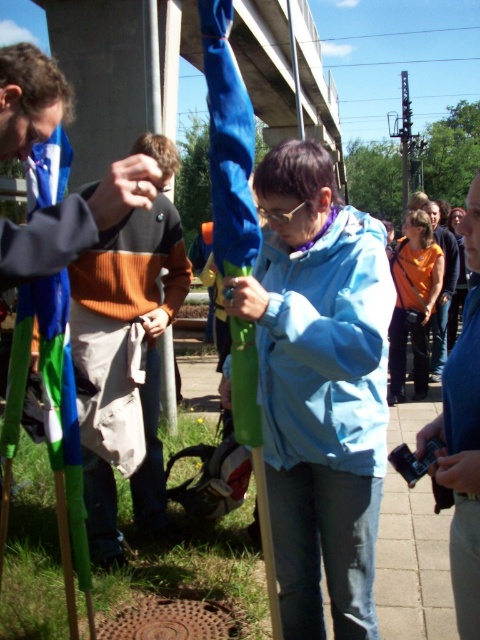
Question: Where is matte black jacket at left located in relation to orange fabric at right in the image?

Choices:
 (A) below
 (B) above

Answer: (B)

Question: Based on their relative distances, which object is farther from the light blue fabric jacket at center?

Choices:
 (A) orange fabric at right
 (B) matte black jacket at left

Answer: (B)

Question: Is light blue fabric jacket at center smaller than matte black jacket at left?

Choices:
 (A) yes
 (B) no

Answer: (A)

Question: Can you confirm if light blue fabric jacket at center is smaller than orange fabric at right?

Choices:
 (A) no
 (B) yes

Answer: (B)

Question: Which object is farther from the camera taking this photo?

Choices:
 (A) orange fabric at right
 (B) matte black jacket at left
 (C) light blue fabric jacket at center

Answer: (C)

Question: Among these points, which one is farthest from the camera?

Choices:
 (A) pos(35,220)
 (B) pos(435,477)

Answer: (B)